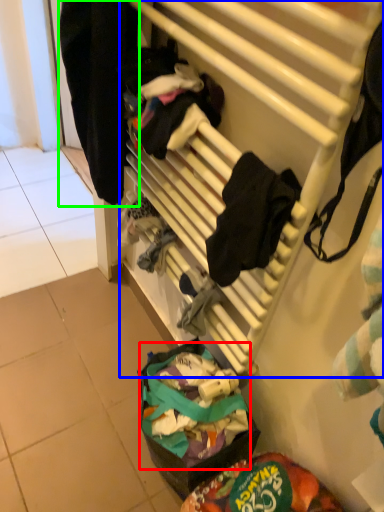
Question: Which object is positioned farthest from food (highlighted by a red box)? Select from furniture (highlighted by a blue box) and clothing (highlighted by a green box).

Choices:
 (A) furniture
 (B) clothing

Answer: (B)